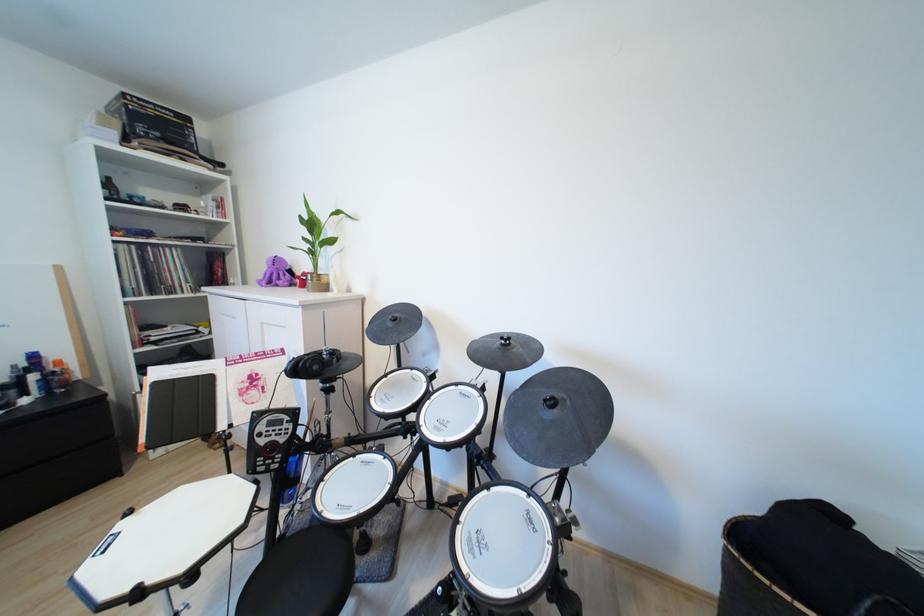
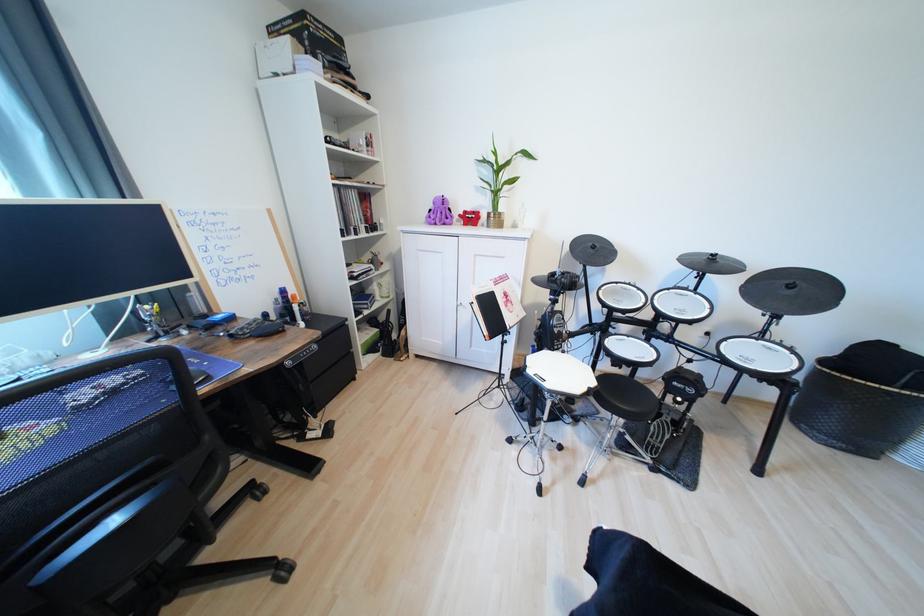
The point at (560, 405) is marked in the first image. Where is the corresponding point in the second image?

(797, 288)